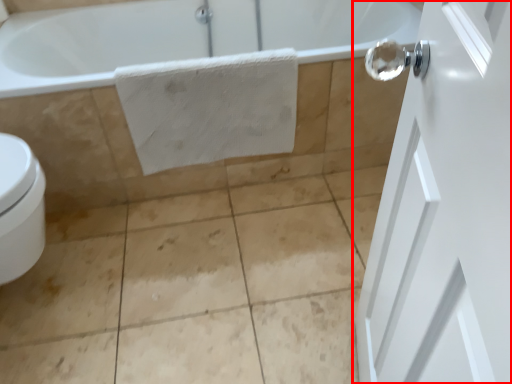
Question: From the image's perspective, what is the correct spatial relationship of door (annotated by the red box) in relation to bath towel?

Choices:
 (A) above
 (B) below

Answer: (B)